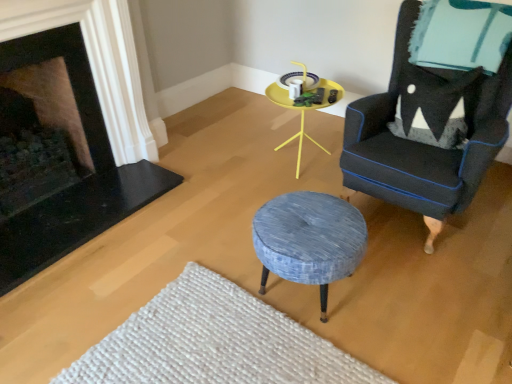
This screenshot has height=384, width=512. Describe the element at coordinates (214, 342) in the screenshot. I see `white textured rug at lower center` at that location.

Measure the distance between point [344,269] and camera.

Point [344,269] and camera are 1.62 meters apart.

What do you see at coordinates (81, 181) in the screenshot? I see `black stone fireplace at left, which is the 2th fireplace from left to right` at bounding box center [81, 181].

What is the approximate width of velvet dark blue armchair at right?

35.89 inches.

Locate an element on the screen. Image resolution: width=512 pixels, height=384 pixels. black stone fireplace at left, acting as the first fireplace starting from the left is located at coordinates (47, 118).

In the scene shown: In terms of size, does white textured rug at lower center appear bigger or smaller than velvet dark blue armchair at right?

Considering their sizes, white textured rug at lower center takes up less space than velvet dark blue armchair at right.

Considering the positions of point (175, 297) and point (365, 192), is point (175, 297) closer or farther from the camera than point (365, 192)?

Point (175, 297).

Is white textured rug at lower center not close to velvet dark blue armchair at right?

Absolutely, white textured rug at lower center is distant from velvet dark blue armchair at right.

Between white textured rug at lower center and velvet dark blue armchair at right, which one appears on the right side from the viewer's perspective?

velvet dark blue armchair at right is more to the right.

From the image's perspective, is black stone fireplace at left, which is the 2th fireplace from left to right, over velvet dark blue armchair at right?

Yes, from the image's perspective, black stone fireplace at left, which is the 2th fireplace from left to right, is above velvet dark blue armchair at right.

Considering the positions of point (33, 36) and point (386, 152), is point (33, 36) closer or farther from the camera than point (386, 152)?

Point (33, 36) is closer to the camera than point (386, 152).

Which of these two, black stone fireplace at left, marked as the first fireplace in a right-to-left arrangement, or velvet dark blue armchair at right, is thinner?

Thinner between the two is black stone fireplace at left, marked as the first fireplace in a right-to-left arrangement.

Can we say textured blue fabric stool at center lies outside black stone fireplace at left, arranged as the second fireplace when viewed from the right?

textured blue fabric stool at center lies outside black stone fireplace at left, arranged as the second fireplace when viewed from the right,'s area.

Can you confirm if textured blue fabric stool at center is positioned to the right of black stone fireplace at left, arranged as the second fireplace when viewed from the right?

Indeed, textured blue fabric stool at center is positioned on the right side of black stone fireplace at left, arranged as the second fireplace when viewed from the right.

Considering the relative positions of textured blue fabric stool at center and black stone fireplace at left, arranged as the second fireplace when viewed from the right, in the image provided, is textured blue fabric stool at center behind black stone fireplace at left, arranged as the second fireplace when viewed from the right,?

No, textured blue fabric stool at center is closer to the viewer.

Considering the sizes of textured blue fabric stool at center and black stone fireplace at left, acting as the first fireplace starting from the left, in the image, is textured blue fabric stool at center bigger or smaller than black stone fireplace at left, acting as the first fireplace starting from the left,?

Considering their sizes, textured blue fabric stool at center takes up less space than black stone fireplace at left, acting as the first fireplace starting from the left.

From a real-world perspective, is yellow plastic table at center below velvet dark blue armchair at right?

Yes, from a real-world perspective, yellow plastic table at center is below velvet dark blue armchair at right.

Which object is wider, yellow plastic table at center or velvet dark blue armchair at right?

With larger width is velvet dark blue armchair at right.

Is yellow plastic table at center next to velvet dark blue armchair at right and touching it?

No, yellow plastic table at center is not touching velvet dark blue armchair at right.

Between yellow plastic table at center and velvet dark blue armchair at right, which one is positioned in front?

velvet dark blue armchair at right is in front.

Looking at this image, from the image's perspective, is textured blue fabric stool at center positioned above or below black stone fireplace at left, which is the 2th fireplace from left to right?

textured blue fabric stool at center is below black stone fireplace at left, which is the 2th fireplace from left to right.

Which point is more forward, (274, 248) or (16, 50)?

Positioned in front is point (274, 248).

Would you say textured blue fabric stool at center is outside black stone fireplace at left, marked as the first fireplace in a right-to-left arrangement?

textured blue fabric stool at center lies outside black stone fireplace at left, marked as the first fireplace in a right-to-left arrangement,'s area.

Which of these two, textured blue fabric stool at center or black stone fireplace at left, which is the 2th fireplace from left to right, is smaller?

Smaller between the two is textured blue fabric stool at center.

Is black stone fireplace at left, which is the 2th fireplace from left to right, taller than black stone fireplace at left, arranged as the second fireplace when viewed from the right?

Yes, black stone fireplace at left, which is the 2th fireplace from left to right, is taller than black stone fireplace at left, arranged as the second fireplace when viewed from the right.

From the picture: Who is bigger, black stone fireplace at left, which is the 2th fireplace from left to right, or black stone fireplace at left, acting as the first fireplace starting from the left?

Bigger between the two is black stone fireplace at left, acting as the first fireplace starting from the left.

Can you see black stone fireplace at left, marked as the first fireplace in a right-to-left arrangement, touching black stone fireplace at left, acting as the first fireplace starting from the left?

They are not placed beside each other.

How much distance is there between textured blue fabric stool at center and white textured rug at lower center?

textured blue fabric stool at center is 16.85 inches from white textured rug at lower center.

Does textured blue fabric stool at center have a smaller size compared to white textured rug at lower center?

Actually, textured blue fabric stool at center might be larger than white textured rug at lower center.

Which object is positioned more to the right, textured blue fabric stool at center or white textured rug at lower center?

Positioned to the right is textured blue fabric stool at center.

Can you see textured blue fabric stool at center touching white textured rug at lower center?

No, textured blue fabric stool at center is not in contact with white textured rug at lower center.

Find the location of a particular element. This screenshot has height=384, width=512. chair behind the white textured rug at lower center is located at coordinates (426, 131).

Starting from the velvet dark blue armchair at right, which fireplace is the 1st one to the left? Please provide its 2D coordinates.

[(81, 181)]

Estimate the real-world distances between objects in this image. Which object is further from black stone fireplace at left, acting as the first fireplace starting from the left, yellow plastic table at center or black stone fireplace at left, which is the 2th fireplace from left to right?

yellow plastic table at center lies further to black stone fireplace at left, acting as the first fireplace starting from the left, than the other object.

Estimate the real-world distances between objects in this image. Which object is closer to black stone fireplace at left, marked as the first fireplace in a right-to-left arrangement, velvet dark blue armchair at right or black stone fireplace at left, arranged as the second fireplace when viewed from the right?

black stone fireplace at left, arranged as the second fireplace when viewed from the right, lies closer to black stone fireplace at left, marked as the first fireplace in a right-to-left arrangement, than the other object.

From the image, which object appears to be nearer to white textured rug at lower center, velvet dark blue armchair at right or black stone fireplace at left, acting as the first fireplace starting from the left?

Among the two, velvet dark blue armchair at right is located nearer to white textured rug at lower center.

When comparing their distances from textured blue fabric stool at center, does black stone fireplace at left, arranged as the second fireplace when viewed from the right, or velvet dark blue armchair at right seem further?

Based on the image, black stone fireplace at left, arranged as the second fireplace when viewed from the right, appears to be further to textured blue fabric stool at center.

When comparing their distances from yellow plastic table at center, does textured blue fabric stool at center or black stone fireplace at left, marked as the first fireplace in a right-to-left arrangement, seem further?

Among the two, black stone fireplace at left, marked as the first fireplace in a right-to-left arrangement, is located further to yellow plastic table at center.

Estimate the real-world distances between objects in this image. Which object is closer to black stone fireplace at left, acting as the first fireplace starting from the left, velvet dark blue armchair at right or white textured rug at lower center?

white textured rug at lower center is positioned closer to the anchor black stone fireplace at left, acting as the first fireplace starting from the left.

Looking at the image, which one is located closer to white textured rug at lower center, black stone fireplace at left, acting as the first fireplace starting from the left, or textured blue fabric stool at center?

textured blue fabric stool at center lies closer to white textured rug at lower center than the other object.

Consider the image. Looking at the image, which one is located closer to black stone fireplace at left, which is the 2th fireplace from left to right, yellow plastic table at center or velvet dark blue armchair at right?

The object closer to black stone fireplace at left, which is the 2th fireplace from left to right, is yellow plastic table at center.

Where is `plain situated between black stone fireplace at left, acting as the first fireplace starting from the left, and yellow plastic table at center from left to right`? The height and width of the screenshot is (384, 512). plain situated between black stone fireplace at left, acting as the first fireplace starting from the left, and yellow plastic table at center from left to right is located at coordinates (214, 342).

I want to click on stool situated between black stone fireplace at left, acting as the first fireplace starting from the left, and yellow plastic table at center from left to right, so click(309, 240).

You are a GUI agent. You are given a task and a screenshot of the screen. Output one action in this format:
    pyautogui.click(x=<x>, y=<y>)
    Task: Click on the fireplace located between black stone fireplace at left, acting as the first fireplace starting from the left, and textured blue fabric stool at center in the left-right direction
    The width and height of the screenshot is (512, 384).
    Given the screenshot: What is the action you would take?
    [x=81, y=181]

Image resolution: width=512 pixels, height=384 pixels. What are the coordinates of `plain situated between black stone fireplace at left, arranged as the second fireplace when viewed from the right, and velvet dark blue armchair at right from left to right` in the screenshot? It's located at (214, 342).